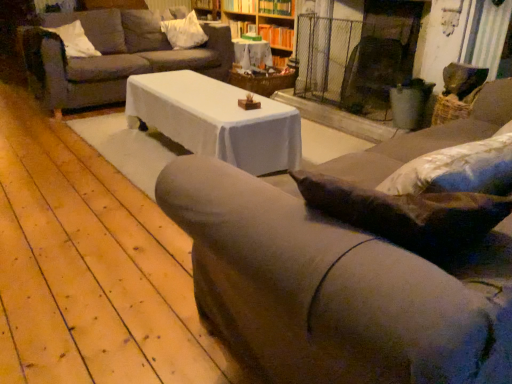
The height and width of the screenshot is (384, 512). What do you see at coordinates (276, 7) in the screenshot?
I see `wooden bookshelf at upper center, the second shelf ordered from the bottom` at bounding box center [276, 7].

How much space does wooden bookshelf at upper center, marked as the first shelf in a top-to-bottom arrangement, occupy horizontally?

It is 9.72 inches.

Measure the distance between white soft pillow at upper left, positioned as the first pillow in left-to-right order, and camera.

The depth of white soft pillow at upper left, positioned as the first pillow in left-to-right order, is 3.59 meters.

This screenshot has width=512, height=384. Describe the element at coordinates (256, 21) in the screenshot. I see `wooden bookshelf at upper center` at that location.

Identify the location of wooden bookshelf at upper center, marked as the second shelf in a top-to-bottom arrangement. point(277,36).

The height and width of the screenshot is (384, 512). Describe the element at coordinates (333, 289) in the screenshot. I see `velvet brown couch at center, positioned as the first studio couch in front-to-back order` at that location.

Locate an element on the screen. Image resolution: width=512 pixels, height=384 pixels. wooden bookshelf at upper center, marked as the first shelf in a top-to-bottom arrangement is located at coordinates (276, 7).

Who is smaller, white fabric pillow at upper center, the 2th pillow viewed from the front, or velvet blue couch at upper left, the 2th studio couch positioned from the front?

With smaller size is white fabric pillow at upper center, the 2th pillow viewed from the front.

From a real-world perspective, is white fabric pillow at upper center, marked as the 1th pillow in a right-to-left arrangement, positioned above or below velvet blue couch at upper left, which appears as the second studio couch when ordered from the bottom?

white fabric pillow at upper center, marked as the 1th pillow in a right-to-left arrangement, is above velvet blue couch at upper left, which appears as the second studio couch when ordered from the bottom.

From the image's perspective, which studio couch is the 1st one below the white fabric pillow at upper center, the 2th pillow viewed from the front? Please provide its 2D coordinates.

[(113, 56)]

Is wooden bookshelf at upper center, marked as the first shelf in a top-to-bottom arrangement, not inside wooden bookshelf at upper center, marked as the second shelf in a top-to-bottom arrangement?

Yes, wooden bookshelf at upper center, marked as the first shelf in a top-to-bottom arrangement, is outside of wooden bookshelf at upper center, marked as the second shelf in a top-to-bottom arrangement.

Is point (288, 10) behind point (283, 44)?

No, (288, 10) is in front of (283, 44).

Considering the sizes of wooden bookshelf at upper center, the second shelf ordered from the bottom, and wooden bookshelf at upper center, marked as the second shelf in a top-to-bottom arrangement, in the image, is wooden bookshelf at upper center, the second shelf ordered from the bottom, taller or shorter than wooden bookshelf at upper center, marked as the second shelf in a top-to-bottom arrangement,?

wooden bookshelf at upper center, the second shelf ordered from the bottom, is shorter than wooden bookshelf at upper center, marked as the second shelf in a top-to-bottom arrangement.

Considering the relative positions of wooden bookshelf at upper center, marked as the first shelf in a top-to-bottom arrangement, and wooden bookshelf at upper center, marked as the second shelf in a top-to-bottom arrangement, in the image provided, is wooden bookshelf at upper center, marked as the first shelf in a top-to-bottom arrangement, in front of wooden bookshelf at upper center, marked as the second shelf in a top-to-bottom arrangement,?

Yes, wooden bookshelf at upper center, marked as the first shelf in a top-to-bottom arrangement, is in front of wooden bookshelf at upper center, marked as the second shelf in a top-to-bottom arrangement.

Considering the sizes of objects velvet brown couch at center, the first studio couch ordered from the bottom, and dark brown leather swivel chair at center in the image provided, who is wider, velvet brown couch at center, the first studio couch ordered from the bottom, or dark brown leather swivel chair at center?

Wider between the two is velvet brown couch at center, the first studio couch ordered from the bottom.

Considering their positions, is velvet brown couch at center, which is the 2th studio couch in left-to-right order, located in front of or behind dark brown leather swivel chair at center?

Visually, velvet brown couch at center, which is the 2th studio couch in left-to-right order, is located in front of dark brown leather swivel chair at center.

From the image's perspective, between velvet brown couch at center, acting as the second studio couch starting from the back, and dark brown leather swivel chair at center, who is located below?

velvet brown couch at center, acting as the second studio couch starting from the back, from the image's perspective.

Can you see dark brown leather swivel chair at center touching velvet brown couch at center, the first studio couch when ordered from right to left?

No, dark brown leather swivel chair at center is not beside velvet brown couch at center, the first studio couch when ordered from right to left.

Which object is positioned more to the right, dark brown leather swivel chair at center or velvet brown couch at center, acting as the second studio couch starting from the back?

From the viewer's perspective, dark brown leather swivel chair at center appears more on the right side.

Which of these two, dark brown leather swivel chair at center or velvet brown couch at center, acting as the second studio couch starting from the back, stands shorter?

dark brown leather swivel chair at center is shorter.

Considering the positions of objects dark brown leather swivel chair at center and wooden bookshelf at upper center in the image provided, who is more to the left, dark brown leather swivel chair at center or wooden bookshelf at upper center?

wooden bookshelf at upper center.

Is dark brown leather swivel chair at center turned away from wooden bookshelf at upper center?

No, dark brown leather swivel chair at center's orientation is not away from wooden bookshelf at upper center.

Is dark brown leather swivel chair at center wider or thinner than wooden bookshelf at upper center?

dark brown leather swivel chair at center is wider than wooden bookshelf at upper center.

From the image's perspective, relative to wooden bookshelf at upper center, is dark brown leather swivel chair at center above or below?

From the image's perspective, dark brown leather swivel chair at center appears below wooden bookshelf at upper center.

From the dark brown leather swivel chair at center, count the 1st shelf to the left and point to it. Please provide its 2D coordinates.

[(276, 7)]

Does dark brown leather swivel chair at center contain wooden bookshelf at upper center, marked as the first shelf in a top-to-bottom arrangement?

No, wooden bookshelf at upper center, marked as the first shelf in a top-to-bottom arrangement, is not surrounded by dark brown leather swivel chair at center.

Considering the positions of objects velvet blue couch at upper left, which is the first studio couch in top-to-bottom order, and white fabric pillow at upper center, the 2th pillow viewed from the front, in the image provided, who is more to the left, velvet blue couch at upper left, which is the first studio couch in top-to-bottom order, or white fabric pillow at upper center, the 2th pillow viewed from the front,?

velvet blue couch at upper left, which is the first studio couch in top-to-bottom order, is more to the left.

Is velvet blue couch at upper left, which is the first studio couch in top-to-bottom order, not near white fabric pillow at upper center, which is the first pillow in back-to-front order?

No, velvet blue couch at upper left, which is the first studio couch in top-to-bottom order, is not far from white fabric pillow at upper center, which is the first pillow in back-to-front order.

Is velvet blue couch at upper left, which appears as the second studio couch when ordered from the bottom, smaller than white fabric pillow at upper center, which is the first pillow in back-to-front order?

No, velvet blue couch at upper left, which appears as the second studio couch when ordered from the bottom, is not smaller than white fabric pillow at upper center, which is the first pillow in back-to-front order.

Identify the location of pillow that is the 2nd one when counting upward from the velvet blue couch at upper left, which is the 1th studio couch in back-to-front order (from the image's perspective). Image resolution: width=512 pixels, height=384 pixels. (184, 32).

I want to click on shelf on the left of the wooden bookshelf at upper center, the second shelf ordered from the bottom, so 277,36.

Considering their positions, is wooden bookshelf at upper center positioned closer to white fabric pillow at upper center, the 2th pillow viewed from the front, than dark brown leather swivel chair at center?

Among the two, wooden bookshelf at upper center is located nearer to white fabric pillow at upper center, the 2th pillow viewed from the front.

Based on their spatial positions, is wooden textured table at center or wooden bookshelf at upper center, the 1th shelf from the bottom, closer to velvet blue couch at upper left, which appears as the second studio couch when ordered from the bottom?

Based on the image, wooden textured table at center appears to be nearer to velvet blue couch at upper left, which appears as the second studio couch when ordered from the bottom.

Considering their positions, is wooden bookshelf at upper center positioned further to wooden bookshelf at upper center, the second shelf ordered from the bottom, than wooden textured table at center?

Among the two, wooden textured table at center is located further to wooden bookshelf at upper center, the second shelf ordered from the bottom.

From the image, which object appears to be farther from velvet brown couch at center, positioned as the first studio couch in front-to-back order, velvet blue couch at upper left, the 2th studio couch viewed from the right, or white soft pillow at upper left, which ranks as the 2th pillow in back-to-front order?

white soft pillow at upper left, which ranks as the 2th pillow in back-to-front order, is positioned further to the anchor velvet brown couch at center, positioned as the first studio couch in front-to-back order.

Looking at the image, which one is located closer to white fabric pillow at upper center, which is the first pillow in back-to-front order, velvet blue couch at upper left, which is the 1th studio couch in back-to-front order, or wooden bookshelf at upper center, marked as the first shelf in a top-to-bottom arrangement?

velvet blue couch at upper left, which is the 1th studio couch in back-to-front order, is positioned closer to the anchor white fabric pillow at upper center, which is the first pillow in back-to-front order.

When comparing their distances from dark brown leather swivel chair at center, does wooden bookshelf at upper center, marked as the first shelf in a top-to-bottom arrangement, or wooden bookshelf at upper center, marked as the second shelf in a top-to-bottom arrangement, seem further?

wooden bookshelf at upper center, marked as the first shelf in a top-to-bottom arrangement, is further to dark brown leather swivel chair at center.

When comparing their distances from wooden bookshelf at upper center, marked as the first shelf in a top-to-bottom arrangement, does velvet brown couch at center, the first studio couch ordered from the bottom, or wooden bookshelf at upper center seem closer?

The object closer to wooden bookshelf at upper center, marked as the first shelf in a top-to-bottom arrangement, is wooden bookshelf at upper center.

From the image, which object appears to be nearer to wooden bookshelf at upper center, wooden textured table at center or white fabric pillow at upper center, marked as the 1th pillow in a right-to-left arrangement?

Among the two, wooden textured table at center is located nearer to wooden bookshelf at upper center.

You are a GUI agent. You are given a task and a screenshot of the screen. Output one action in this format:
    pyautogui.click(x=<x>, y=<y>)
    Task: Click on the studio couch between velvet brown couch at center, which is the 2th studio couch in left-to-right order, and wooden bookshelf at upper center from front to back
    This screenshot has width=512, height=384.
    Given the screenshot: What is the action you would take?
    pyautogui.click(x=113, y=56)

Find the location of a particular element. The image size is (512, 384). table situated between white soft pillow at upper left, the second pillow in the right-to-left sequence, and dark brown leather swivel chair at center from left to right is located at coordinates (252, 54).

The height and width of the screenshot is (384, 512). Identify the location of table between velvet blue couch at upper left, the 2th studio couch viewed from the right, and wooden bookshelf at upper center, the 1th shelf from the bottom, from left to right. (252, 54).

At what (x,y) coordinates should I click in order to perform the action: click on swivel chair between velvet brown couch at center, the second studio couch when ordered from top to bottom, and wooden bookshelf at upper center, the second shelf ordered from the bottom, from front to back. Please return your answer as a coordinate pair (x, y). Image resolution: width=512 pixels, height=384 pixels. Looking at the image, I should click on (371, 74).